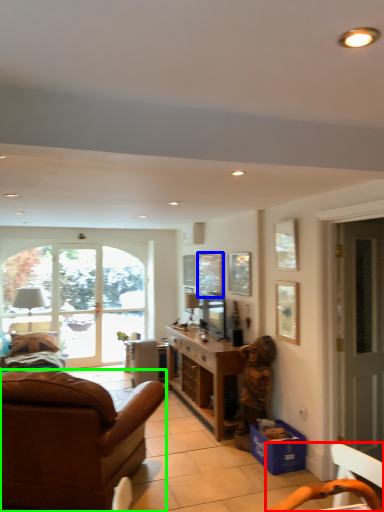
Question: Based on their relative distances, which object is farther from chair (highlighted by a red box)? Choose from window screen (highlighted by a blue box) and studio couch (highlighted by a green box).

Choices:
 (A) window screen
 (B) studio couch

Answer: (A)